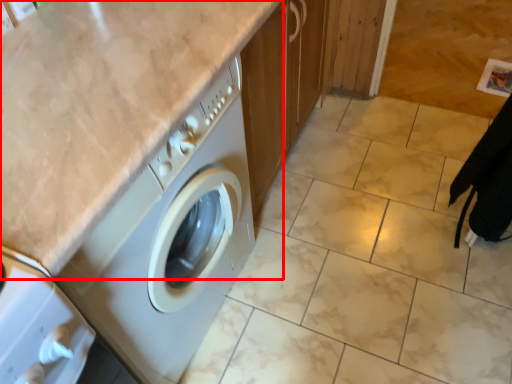
Question: In this image, where is counter top (annotated by the red box) located relative to granite?

Choices:
 (A) right
 (B) left

Answer: (B)